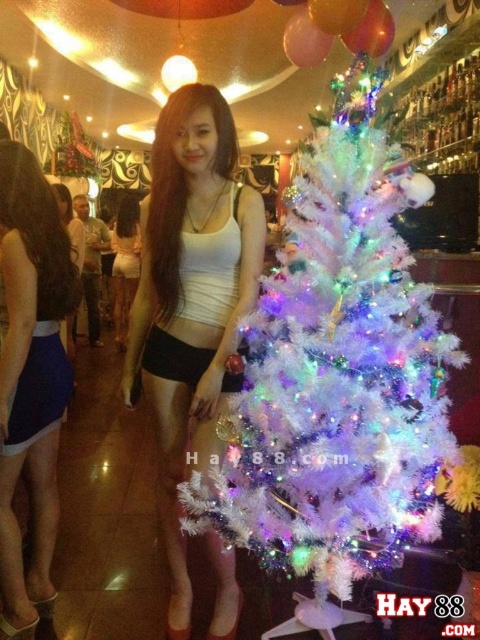
Question: Can you confirm if white matte tank top at center is positioned to the right of blue satin skirt at lower left?

Choices:
 (A) no
 (B) yes

Answer: (B)

Question: Estimate the real-world distances between objects in this image. Which object is closer to the white matte tank top at center?

Choices:
 (A) blue satin skirt at lower left
 (B) white fluffy christmas tree at center

Answer: (B)

Question: Which point is closer to the camera taking this photo?

Choices:
 (A) (63, 268)
 (B) (265, 420)
 (C) (249, 234)

Answer: (B)

Question: Among these points, which one is farthest from the camera?

Choices:
 (A) (230, 179)
 (B) (34, 516)
 (C) (233, 483)

Answer: (B)

Question: Where is white matte tank top at center located in relation to blue satin skirt at lower left in the image?

Choices:
 (A) above
 (B) below

Answer: (A)

Question: Is white fluffy christmas tree at center behind blue satin skirt at lower left?

Choices:
 (A) yes
 (B) no

Answer: (B)